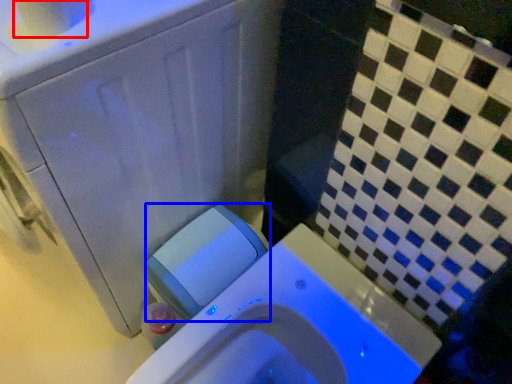
Question: Which object appears farthest to the camera in this image, toilet paper (highlighted by a red box) or water tank (highlighted by a blue box)?

Choices:
 (A) toilet paper
 (B) water tank

Answer: (B)